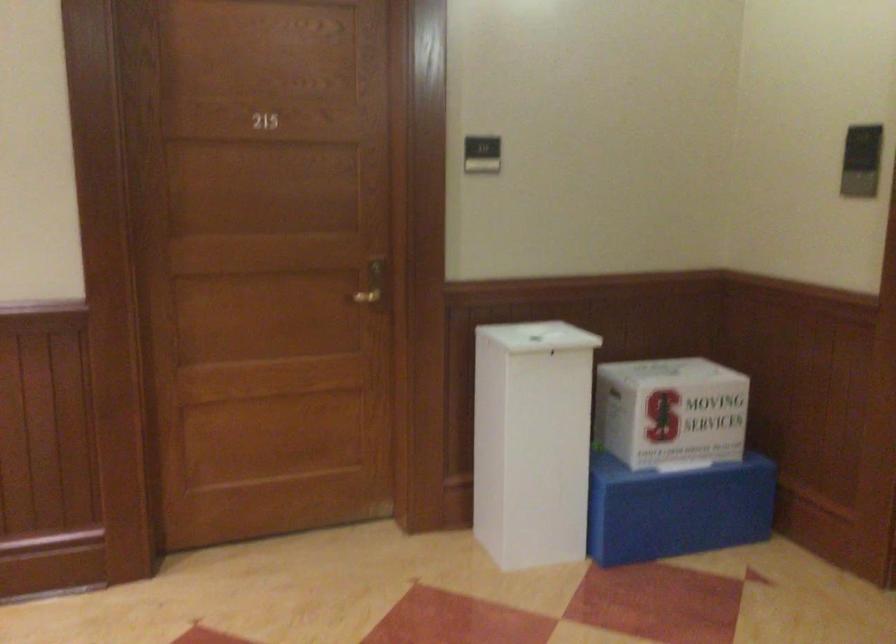
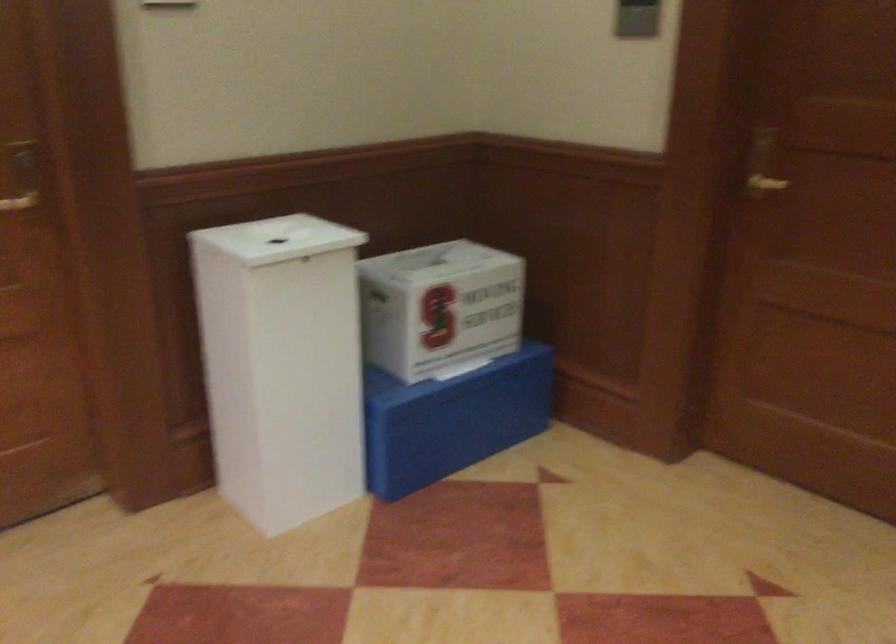
Find the pixel in the second image that matches the point at 536,337 in the first image.

(277, 238)